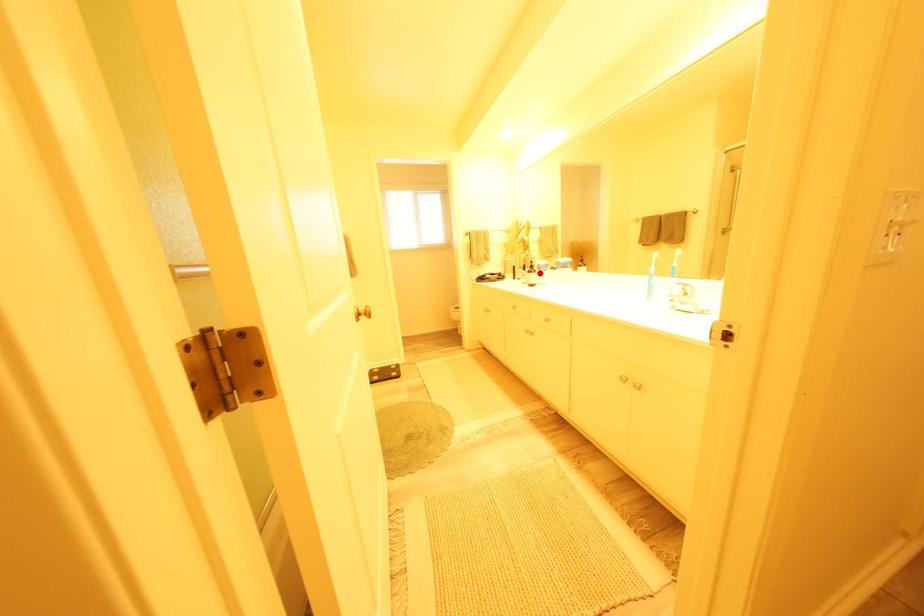
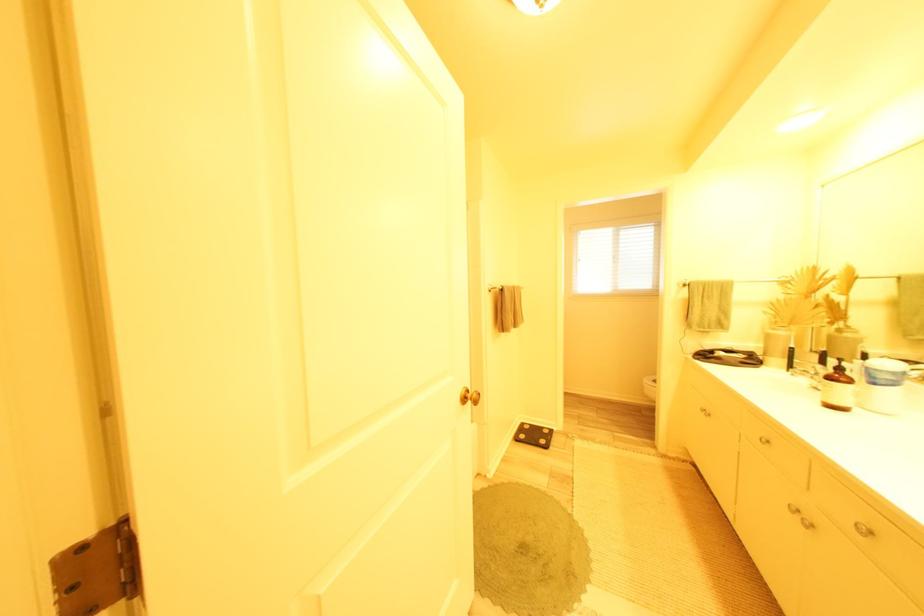
The point at the highlighted location is marked in the first image. Where is the corresponding point in the second image?

(841, 379)